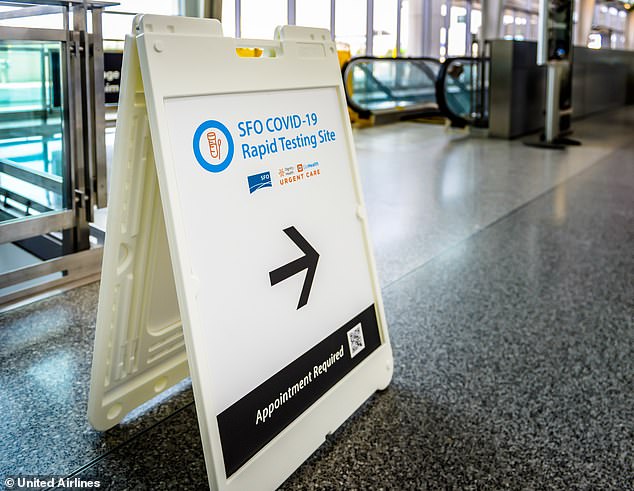
This screenshot has width=634, height=491. In order to click on wall in this screenshot , I will do `click(595, 64)`.